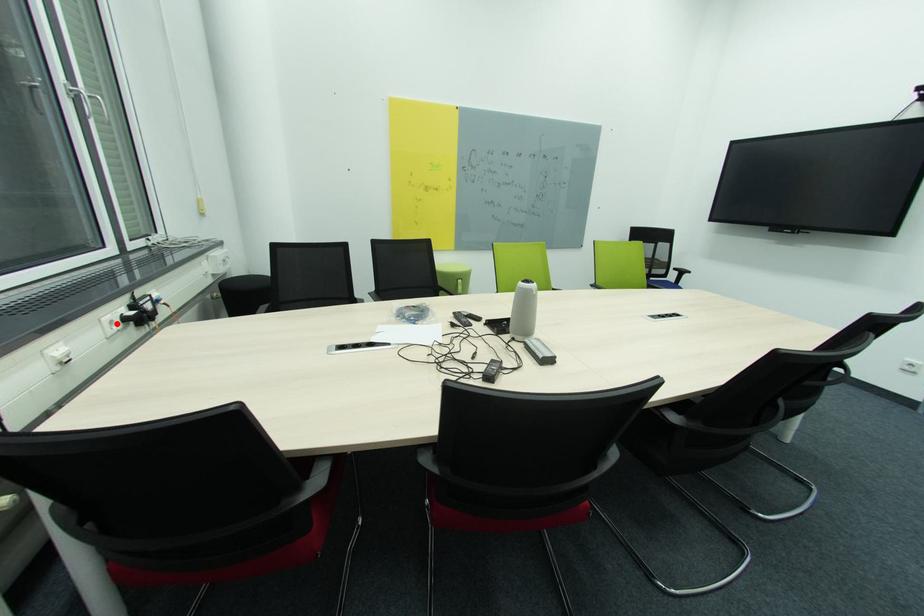
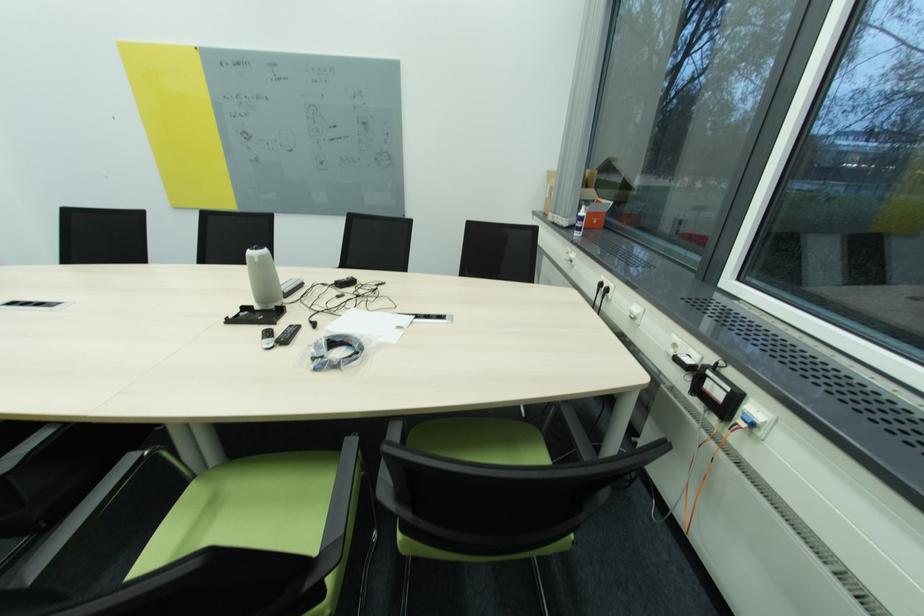
Find the pixel in the second image that matches the highlighted location in the first image.

(679, 346)